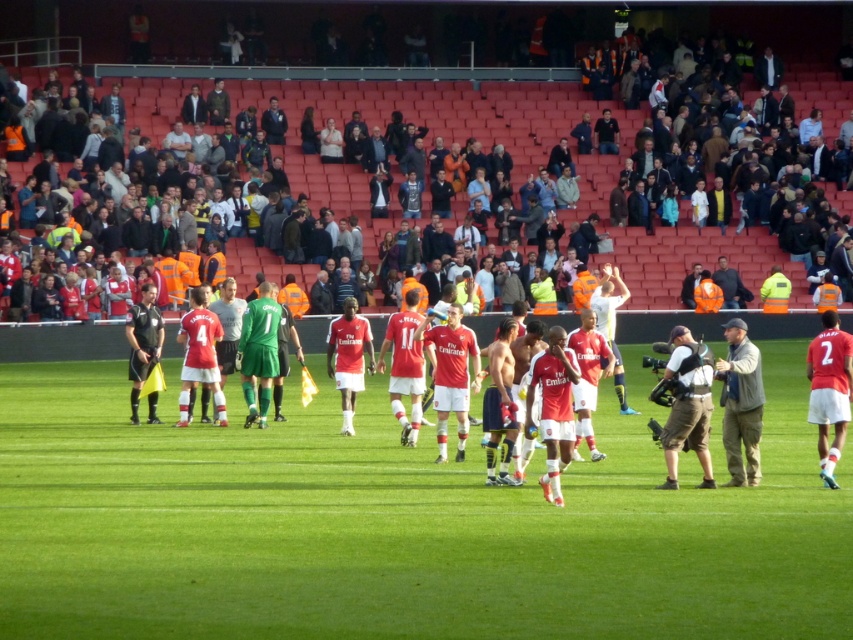
Looking at this image, is green grass field at center positioned behind camouflage-patterned vest at center-right?

No.

Is point (416, 582) positioned after point (700, 440)?

No, (416, 582) is closer to viewer.

Where is `green grass field at center`? green grass field at center is located at coordinates click(399, 525).

Based on the photo, is green grass field at center smaller than gray fabric jacket at right?

Actually, green grass field at center might be larger than gray fabric jacket at right.

Between green grass field at center and gray fabric jacket at right, which one has less height?

gray fabric jacket at right is shorter.

Does point (682, 531) lie behind point (753, 376)?

No, (682, 531) is in front of (753, 376).

Where is `green grass field at center`? The width and height of the screenshot is (853, 640). green grass field at center is located at coordinates (399, 525).

Which is behind, point (199, 458) or point (276, 138)?

Point (276, 138)

Is green grass field at center bigger than dark blue suit at upper center?

Correct, green grass field at center is larger in size than dark blue suit at upper center.

Is point (733, 500) in front of point (271, 100)?

Yes, it is.

The image size is (853, 640). Identify the location of green grass field at center. (399, 525).